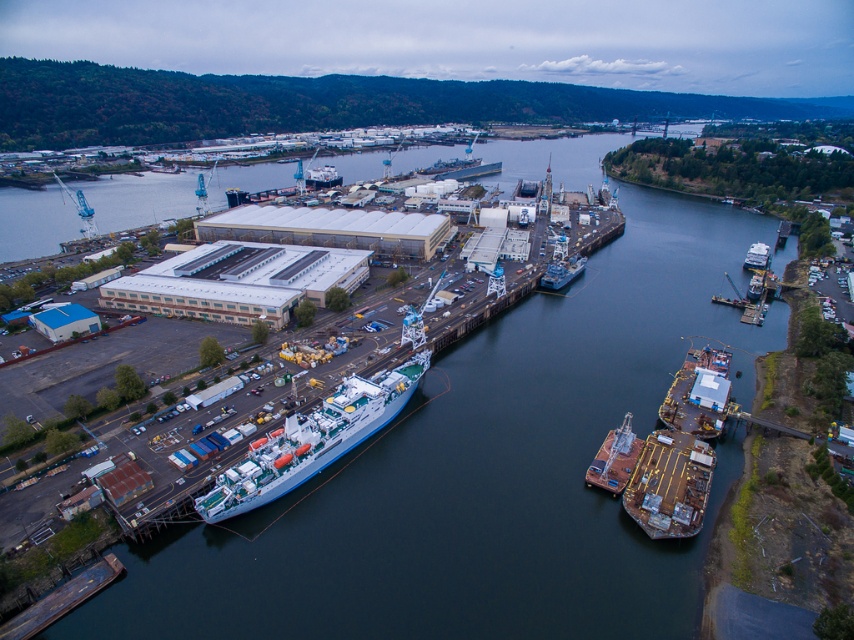
Is dark blue water at center taller than rusty metallic boat at lower right?

Correct, dark blue water at center is much taller as rusty metallic boat at lower right.

Locate an element on the screen. The height and width of the screenshot is (640, 854). dark blue water at center is located at coordinates (483, 476).

Can you confirm if rusty metallic boat at lower right is positioned below rusty metal boat at center?

Yes.

The image size is (854, 640). Describe the element at coordinates (670, 484) in the screenshot. I see `rusty metallic boat at lower right` at that location.

Who is more forward, (657, 506) or (609, 458)?

Point (657, 506) is in front.

Identify the location of rusty metallic boat at lower right. (670, 484).

Can you confirm if rusty metal boat at center is positioned to the right of white glossy boat at upper right?

Incorrect, rusty metal boat at center is not on the right side of white glossy boat at upper right.

Who is positioned more to the right, rusty metal boat at center or white glossy boat at upper right?

From the viewer's perspective, white glossy boat at upper right appears more on the right side.

Which is behind, point (605, 442) or point (765, 253)?

The point (765, 253) is behind.

Image resolution: width=854 pixels, height=640 pixels. Find the location of `rusty metal boat at center`. rusty metal boat at center is located at coordinates click(x=613, y=458).